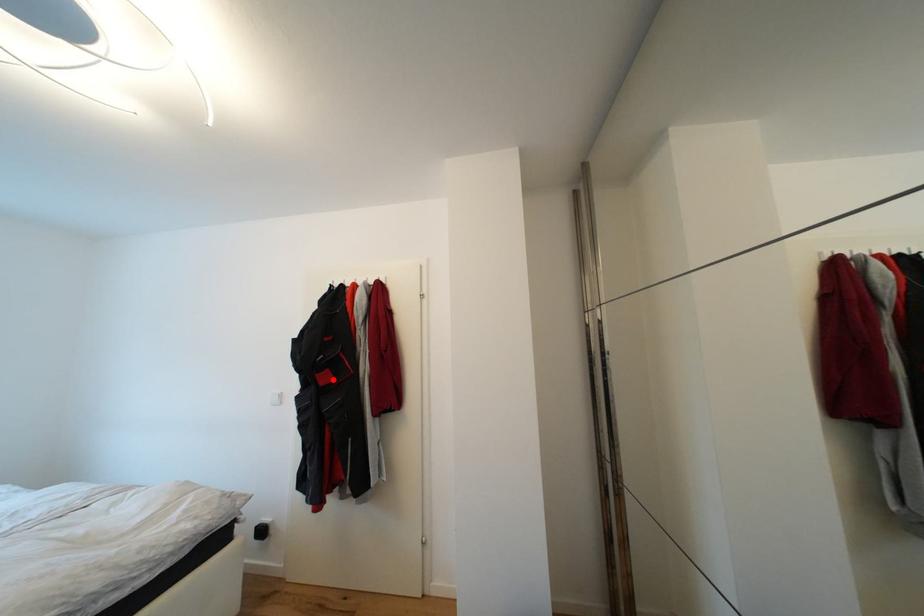
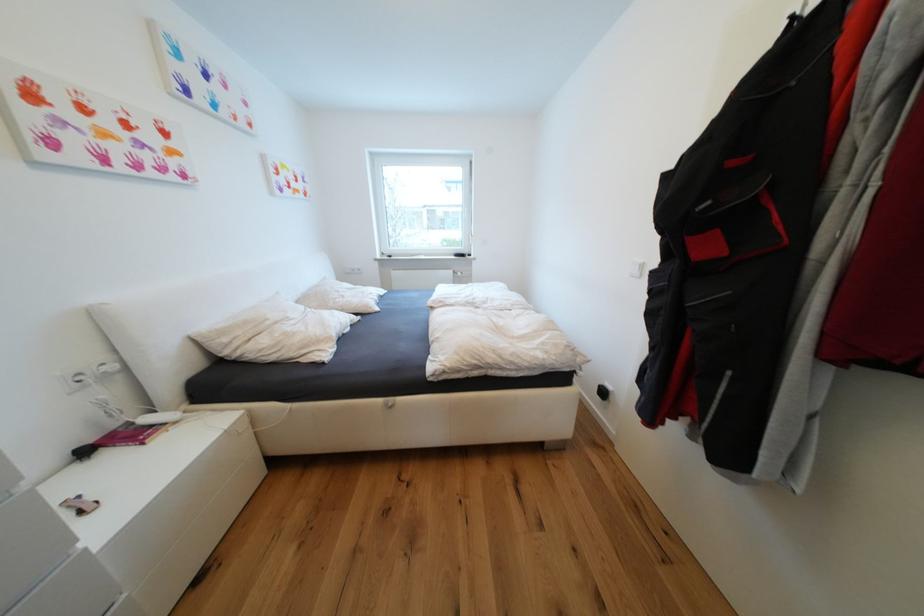
In the second image, find the point that corresponds to the highlighted location in the first image.

(714, 249)